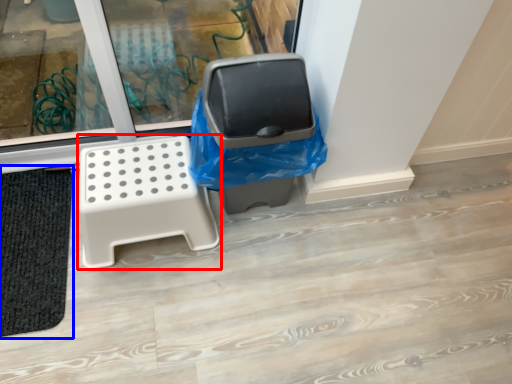
Question: Which point is further to the camera, furniture (highlighted by a red box) or bath mat (highlighted by a blue box)?

Choices:
 (A) furniture
 (B) bath mat

Answer: (B)